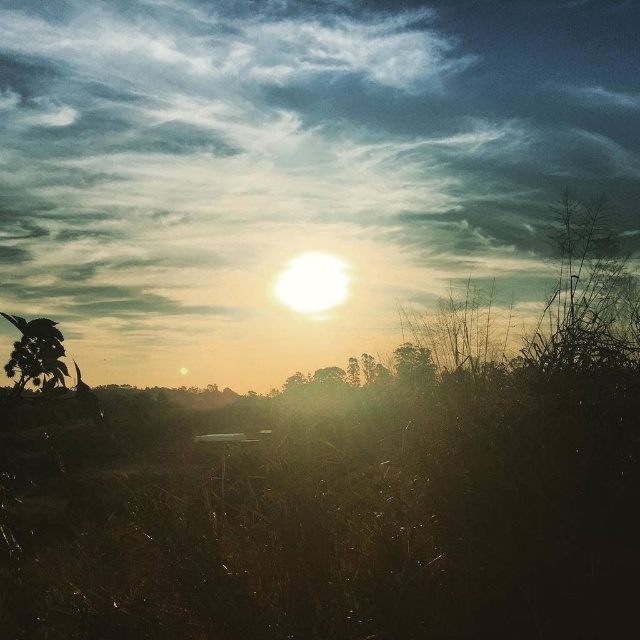
You are standing at the center of the image and want to walk towards the green leafy tree at lower left. In which direction should you move?

You should move towards the lower left direction to reach the green leafy tree at lower left, as it is located at point (35, 355).

You are standing in the middle of the field and see the green leafy tree at lower left and the green matte tree at right. Which tree is closer to your left side?

The green leafy tree at lower left is closer to your left side because it is positioned on the left side of the green matte tree at right.